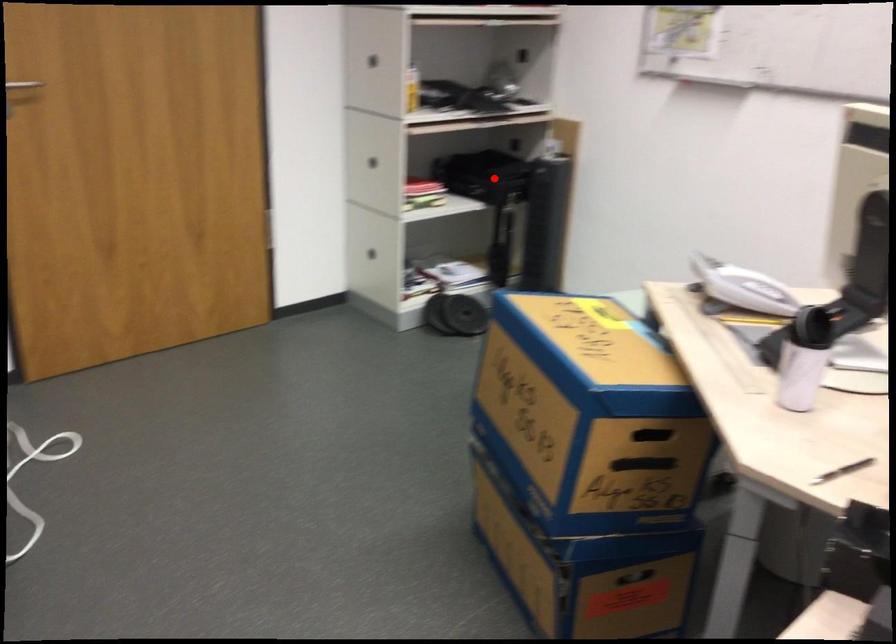
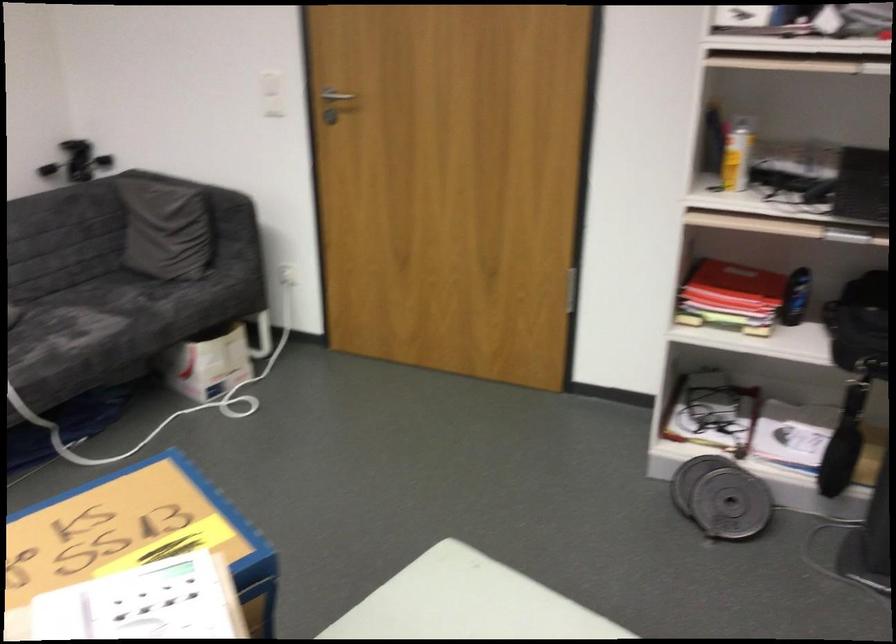
Locate, in the second image, the point that corresponds to the highlighted location in the first image.

(859, 325)